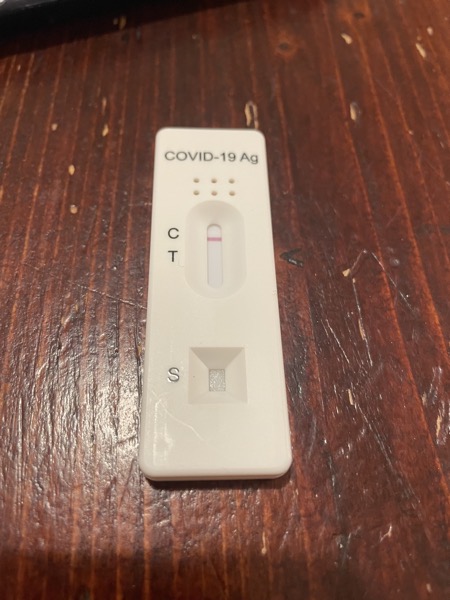
Where is `brown wood table`? The image size is (450, 600). brown wood table is located at coordinates (229, 49).